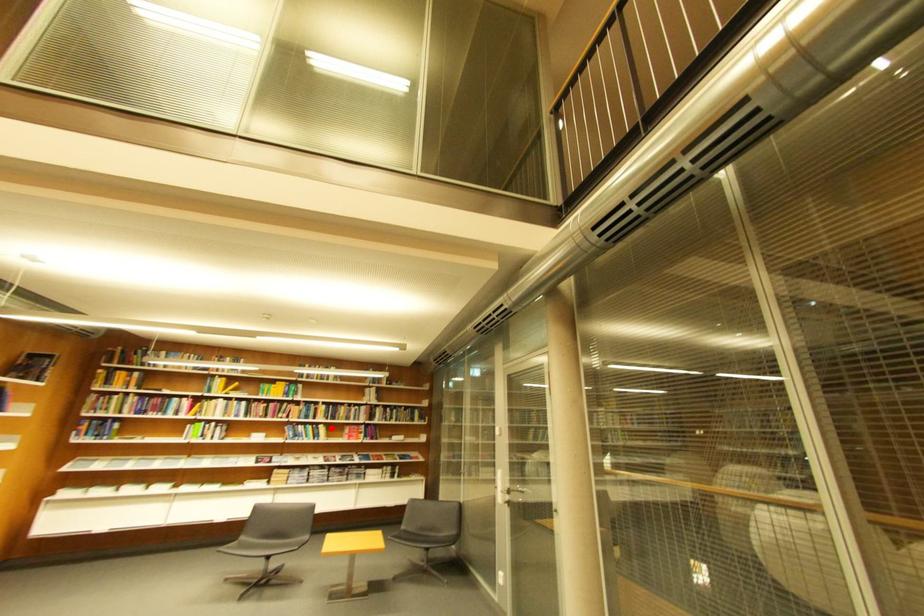
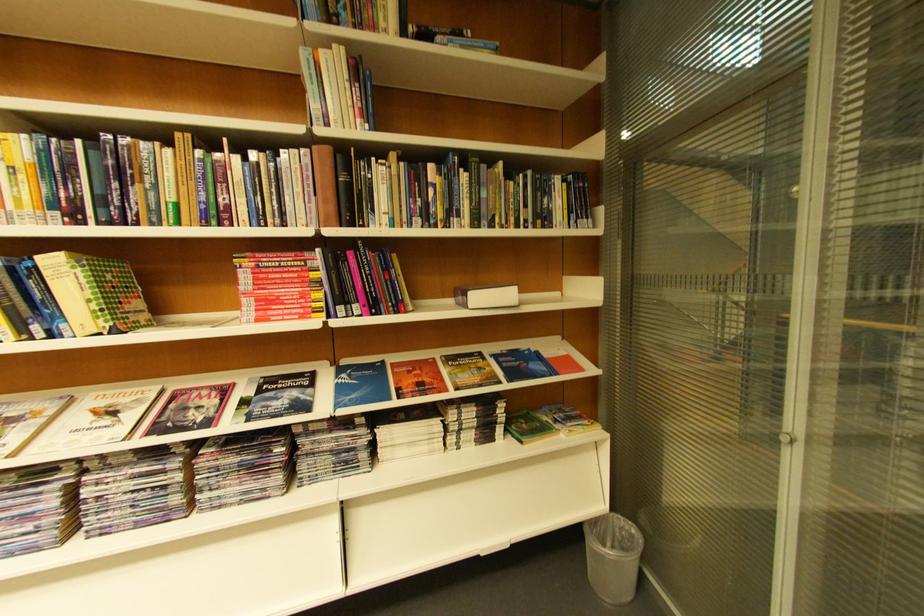
Question: A red point is marked in image1. In image2, is the corresponding 3D point closer to the camera or farther? Reply with the corresponding letter.

Choices:
 (A) The corresponding 3D point is closer.
 (B) The corresponding 3D point is farther.

Answer: (A)